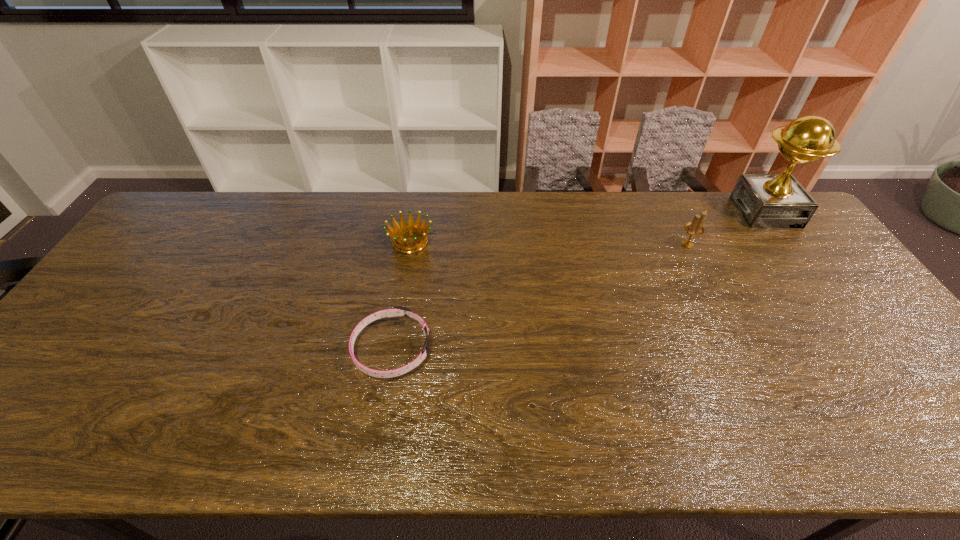
Locate an element on the screen. The width and height of the screenshot is (960, 540). the rightmost object is located at coordinates (765, 200).

At what (x,y) coordinates should I click in order to perform the action: click on award. Please return your answer as a coordinate pair (x, y). The image size is (960, 540). Looking at the image, I should click on (765, 200).

At what (x,y) coordinates should I click in order to perform the action: click on candle holder. Please return your answer as a coordinate pair (x, y). The image size is (960, 540). Looking at the image, I should click on pos(695,227).

Locate an element on the screen. The image size is (960, 540). the third shortest object is located at coordinates (695, 227).

The image size is (960, 540). In order to click on the second shortest object in this screenshot , I will do [404, 227].

Locate an element on the screen. The image size is (960, 540). dog collar is located at coordinates (398, 310).

Find the location of a particular element. The width and height of the screenshot is (960, 540). the shortest object is located at coordinates tap(398, 310).

I want to click on vacant space situated 0.160m on the front-facing side of the rightmost object, so click(691, 212).

Find the location of a particular element. This screenshot has height=540, width=960. vacant space located on the front-facing side of the rightmost object is located at coordinates (650, 212).

Where is `vacant space located on the front-facing side of the rightmost object`? This screenshot has width=960, height=540. vacant space located on the front-facing side of the rightmost object is located at coordinates (636, 212).